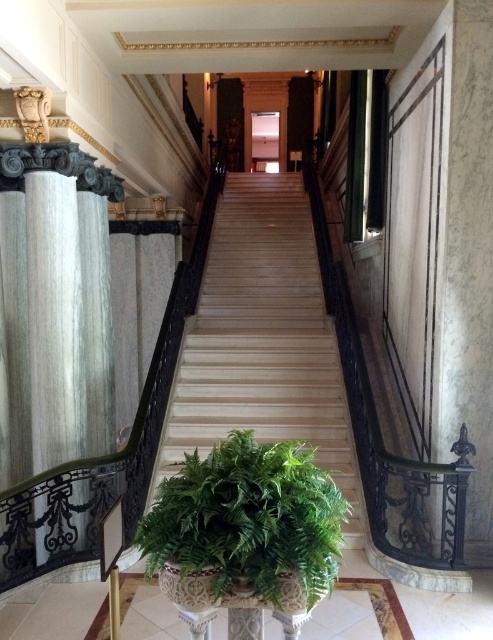
Is point (258, 333) positioned before point (164, 524)?

That is False.

Which is above, wooden stairs at center or green leafy plant at lower center?

wooden stairs at center

Locate an element on the screen. wooden stairs at center is located at coordinates coord(262,340).